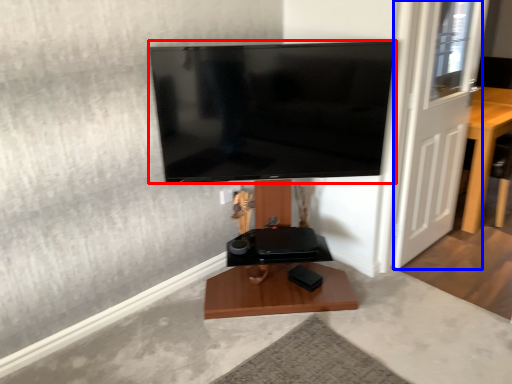
Question: Which point is further to the camera, television (highlighted by a red box) or door (highlighted by a blue box)?

Choices:
 (A) television
 (B) door

Answer: (B)